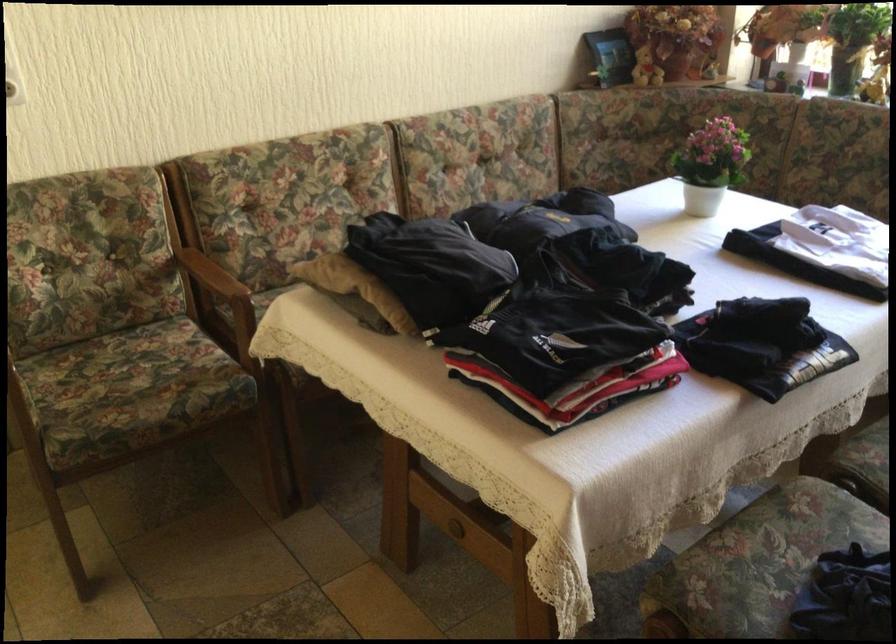
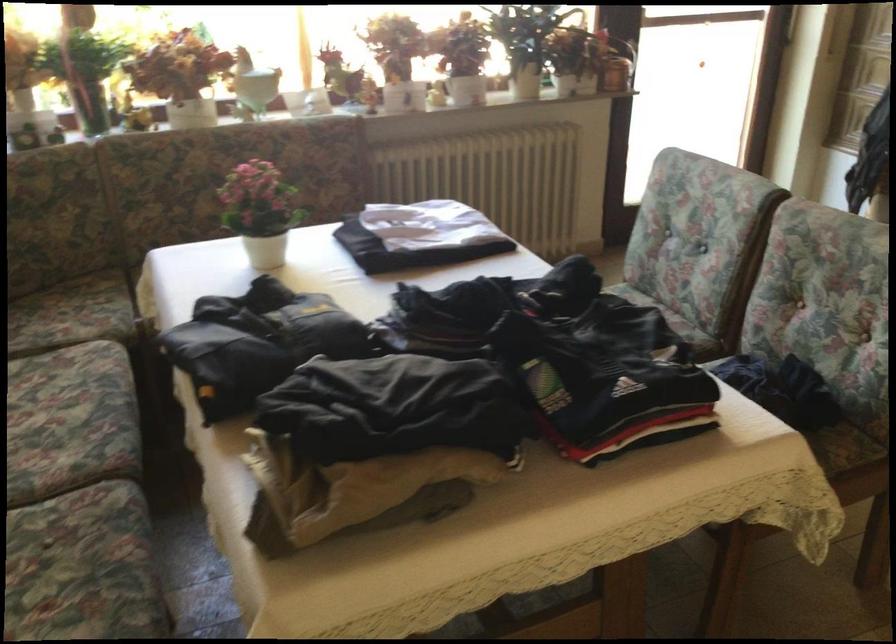
Find the pixel in the second image that matches point 686,160 in the first image.

(261, 212)